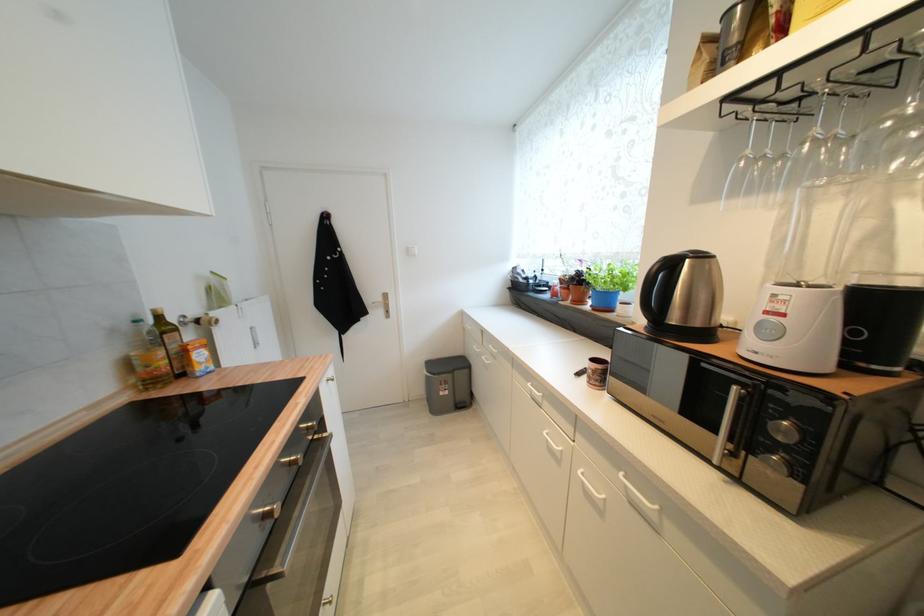
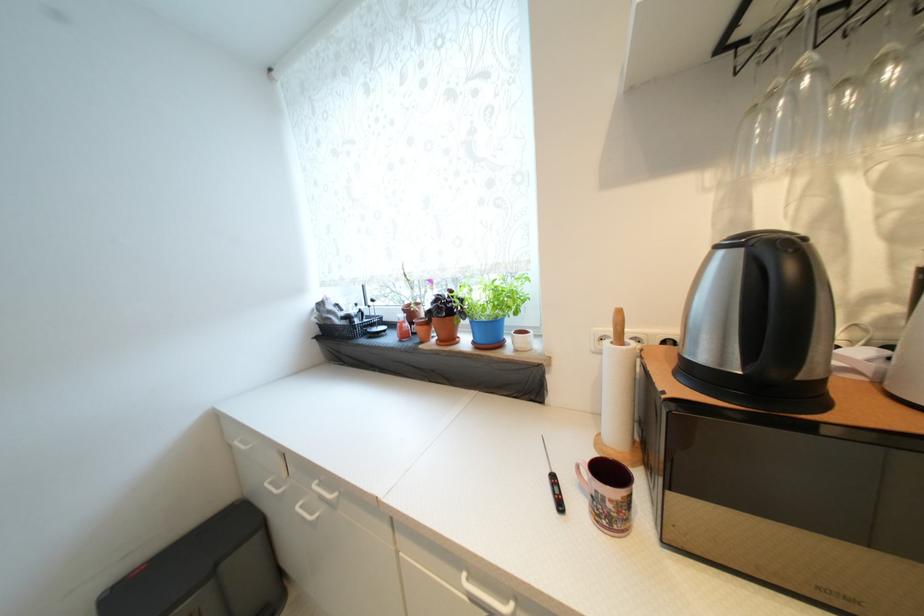
Find the pixel in the second image that matches point (471, 373) in the first image.

(261, 541)